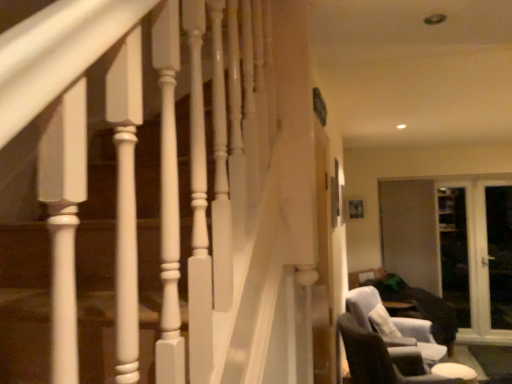
Question: Is transparent glass screen door at right, placed as the fourth screen door when sorted from right to left, looking in the opposite direction of white glossy door at right, positioned as the 4th screen door in left-to-right order?

Choices:
 (A) no
 (B) yes

Answer: (A)

Question: Is transparent glass screen door at right, the first screen door when ordered from left to right, in contact with white glossy door at right, positioned as the 4th screen door in left-to-right order?

Choices:
 (A) no
 (B) yes

Answer: (A)

Question: Does transparent glass screen door at right, placed as the fourth screen door when sorted from right to left, have a smaller size compared to white glossy door at right, placed as the first screen door when sorted from right to left?

Choices:
 (A) yes
 (B) no

Answer: (A)

Question: Would you say transparent glass screen door at right, placed as the fourth screen door when sorted from right to left, is a long distance from white glossy door at right, placed as the first screen door when sorted from right to left?

Choices:
 (A) no
 (B) yes

Answer: (A)

Question: Is white glossy door at right, positioned as the 4th screen door in left-to-right order, located within transparent glass screen door at right, placed as the fourth screen door when sorted from right to left?

Choices:
 (A) yes
 (B) no

Answer: (B)

Question: From the image's perspective, is transparent glass screen door at right, the first screen door when ordered from left to right, under white glossy door at right, positioned as the 4th screen door in left-to-right order?

Choices:
 (A) yes
 (B) no

Answer: (B)

Question: Is transparent glass screen door at right, acting as the 2th screen door starting from the left, wider than white glossy door at right, placed as the first screen door when sorted from right to left?

Choices:
 (A) yes
 (B) no

Answer: (B)

Question: Is transparent glass screen door at right, acting as the 2th screen door starting from the left, positioned before white glossy door at right, placed as the first screen door when sorted from right to left?

Choices:
 (A) yes
 (B) no

Answer: (B)

Question: Is white glossy door at right, placed as the first screen door when sorted from right to left, completely or partially inside transparent glass screen door at right, which appears as the third screen door when viewed from the right?

Choices:
 (A) yes
 (B) no

Answer: (A)

Question: From a real-world perspective, is transparent glass screen door at right, acting as the 2th screen door starting from the left, below white glossy door at right, positioned as the 4th screen door in left-to-right order?

Choices:
 (A) no
 (B) yes

Answer: (B)

Question: Can you confirm if transparent glass screen door at right, acting as the 2th screen door starting from the left, is bigger than white glossy door at right, placed as the first screen door when sorted from right to left?

Choices:
 (A) yes
 (B) no

Answer: (A)

Question: Is transparent glass screen door at right, which appears as the third screen door when viewed from the right, aimed at white glossy door at right, positioned as the 4th screen door in left-to-right order?

Choices:
 (A) no
 (B) yes

Answer: (B)

Question: From the image's perspective, is dark gray fabric chair at lower right above transparent glass screen door at right, which appears as the third screen door when viewed from the right?

Choices:
 (A) yes
 (B) no

Answer: (B)